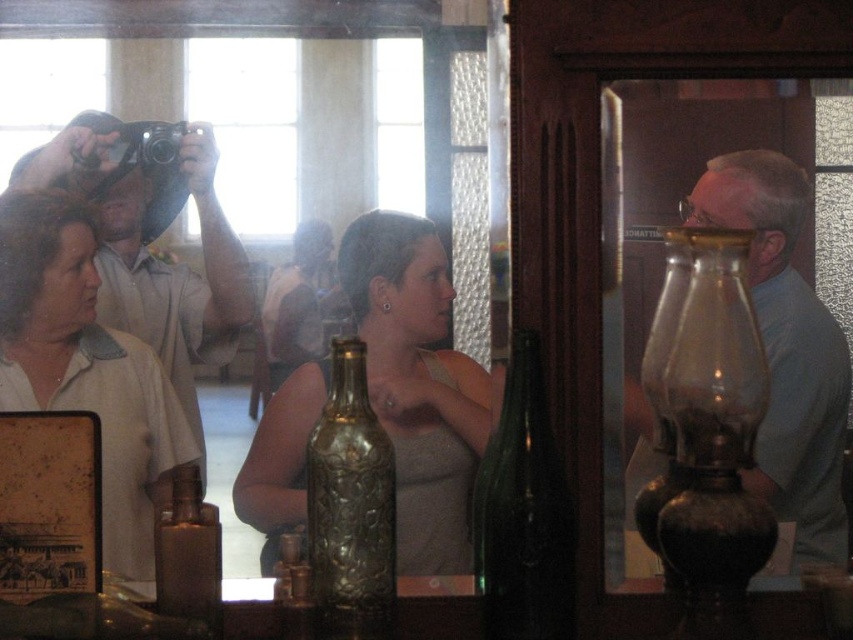
Question: Which point is closer to the camera?

Choices:
 (A) (212, 609)
 (B) (509, 518)
 (C) (759, 540)
 (D) (372, 355)

Answer: (A)

Question: Is matte gold bottle at center positioned before gold textured bottle at center?

Choices:
 (A) no
 (B) yes

Answer: (A)

Question: Among these objects, which one is nearest to the camera?

Choices:
 (A) gold textured bottle at center
 (B) transparent glass lamp at right
 (C) shiny brown bottle at center
 (D) matte gold bottle at center

Answer: (C)

Question: Is matte blue shirt at right to the right of green glass bottle at center from the viewer's perspective?

Choices:
 (A) yes
 (B) no

Answer: (A)

Question: Can you confirm if matte black camera at upper left is smaller than shiny brown bottle at center?

Choices:
 (A) no
 (B) yes

Answer: (A)

Question: Which point is farther to the camera?

Choices:
 (A) (521, 481)
 (B) (378, 605)
 (C) (421, 536)
 (D) (761, 305)

Answer: (C)